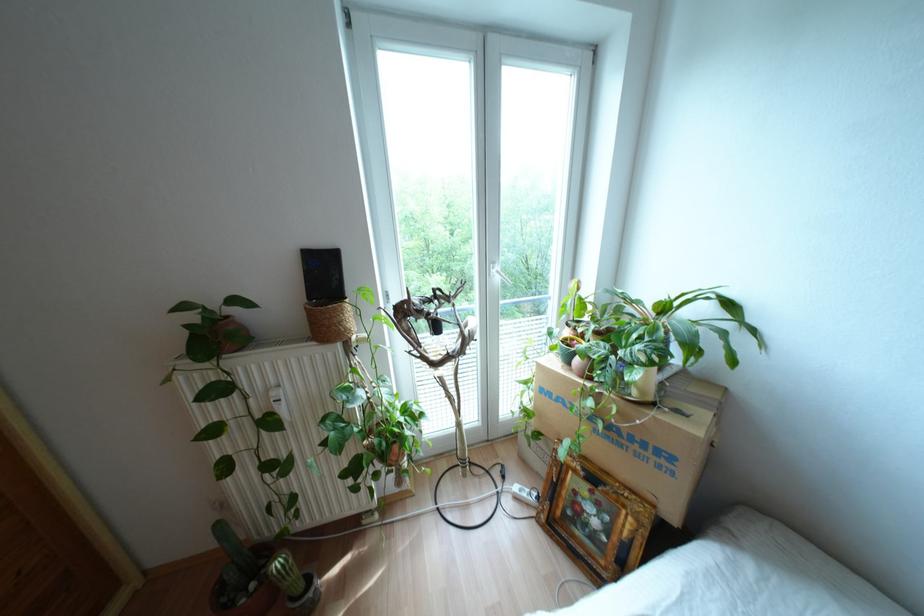
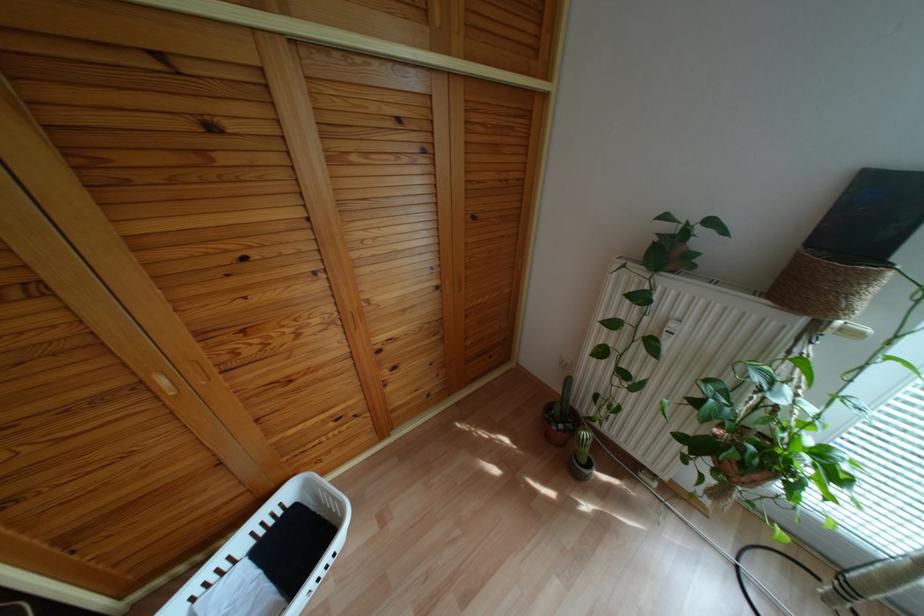
In the second image, find the point that corresponds to [251,585] in the first image.

(560, 424)